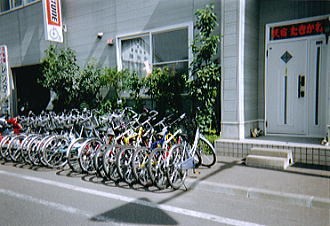
Where is `stair steps`? The height and width of the screenshot is (226, 330). stair steps is located at coordinates (269, 152), (265, 159).